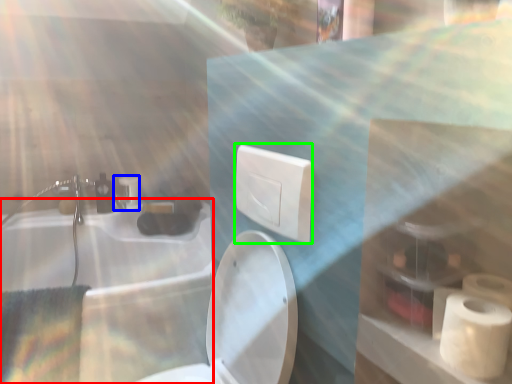
Question: Which is farther away from bath (highlighted by a red box)? faucet (highlighted by a blue box) or electric outlet (highlighted by a green box)?

Choices:
 (A) faucet
 (B) electric outlet

Answer: (B)